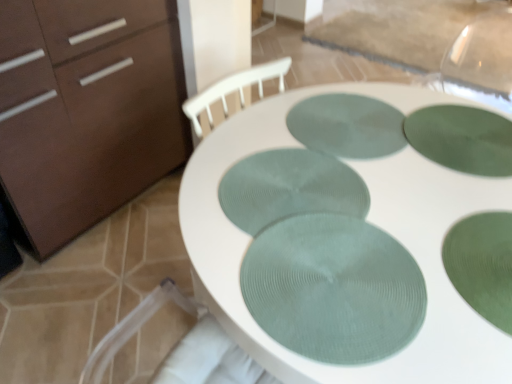
I want to click on free space that is in between green textured placemat at center, which is the fifth glass plate in front-to-back order, and green textured glass at center, positioned as the fourth glass plate in back-to-front order, so click(x=420, y=192).